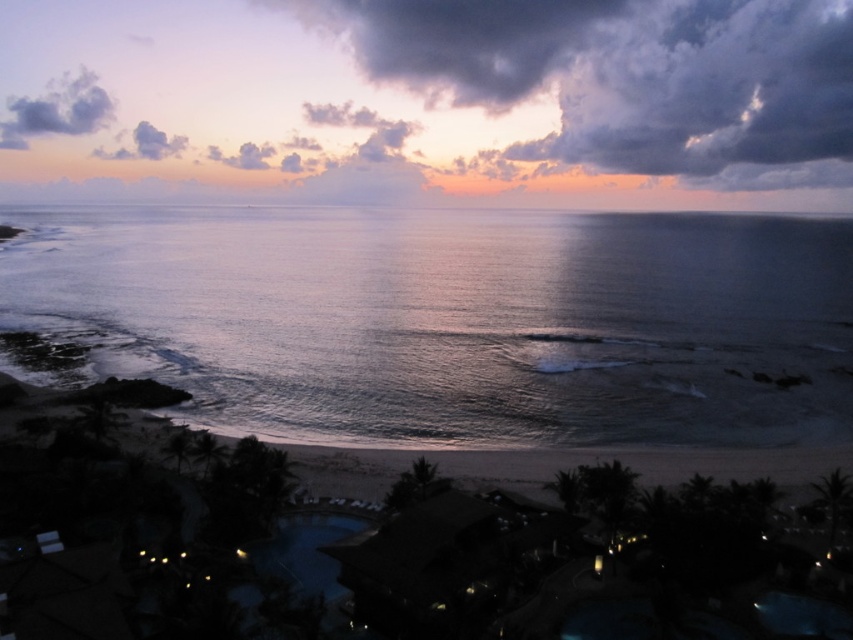
You are standing at the point marked by the coordinates point (454, 320), which is in the center of the image. Looking towards the horizon, you see the horizon line. In which direction from your current position is the horizon?

The horizon is located above the point (454, 320) since the point marks shiny blue water at center, which is below the horizon line in the beach scene.

You are standing on the beach and see two points marked on the sand. One is at coordinate point (485, 333) and the other at point (80, 113). If you want to reach the point that is closer to you first, which coordinate should you head towards?

You should head towards point (485, 333) because it is closer to the viewer than point (80, 113).

You are an astronomer observing the sky from the beach. You notice two clouds in the sky. The cloudy sky at upper center and the dark gray cloud at upper left. Which of these two clouds is bigger in size?

The cloudy sky at upper center is larger in size than the dark gray cloud at upper left.